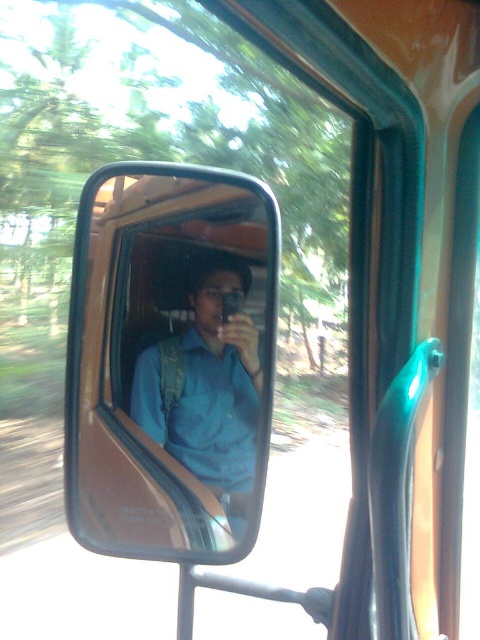
You are a passenger on a moving vehicle and you want to check if your shirt is visible in the side mirror. Given that the black matte mirror at center is wider than the blue fabric shirt at center, can you see your entire shirt in the mirror?

The black matte mirror at center is wider than the blue fabric shirt at center, so yes, the entire shirt can be seen in the mirror since the mirror is wider than the shirt.

You are a passenger on a moving bus or train. You notice a black matte mirror at center and a blue fabric shirt at center. Which object is positioned higher in the scene?

The black matte mirror at center is above the blue fabric shirt at center, so it is positioned higher in the scene.

You are inside a moving bus or train and see a point at coordinates (170, 362). What object is located at that position?

The point at coordinates (170, 362) corresponds to the black matte mirror at center.